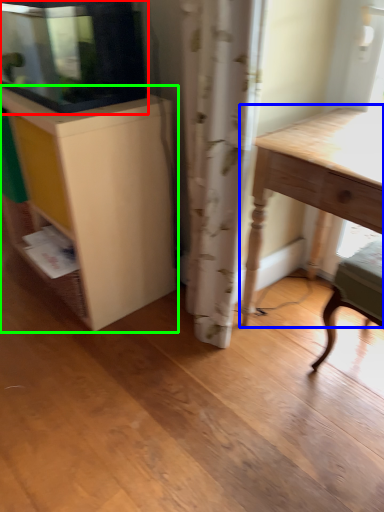
Question: Estimate the real-world distances between objects in this image. Which object is closer to cabinetry (highlighted by a red box), table (highlighted by a blue box) or cabinetry (highlighted by a green box)?

Choices:
 (A) table
 (B) cabinetry

Answer: (B)